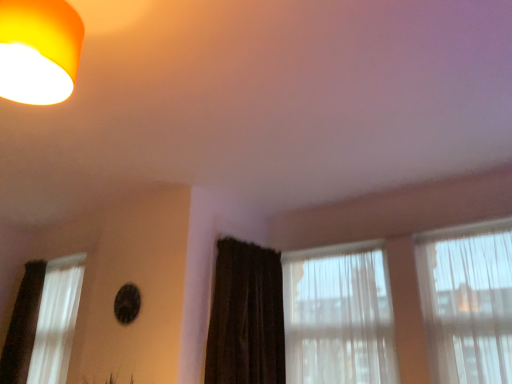
Question: Should I look upward or downward to see translucent fabric curtain at center, positioned as the 2th window in left-to-right order?

Choices:
 (A) down
 (B) up

Answer: (A)

Question: From a real-world perspective, is translucent fabric curtain at center, positioned as the second window in right-to-left order, below translucent fabric curtain at right, placed as the first window when sorted from right to left?

Choices:
 (A) no
 (B) yes

Answer: (B)

Question: From a real-world perspective, is translucent fabric curtain at center, positioned as the second window in right-to-left order, located higher than translucent fabric curtain at right, placed as the first window when sorted from right to left?

Choices:
 (A) yes
 (B) no

Answer: (B)

Question: From the image's perspective, is translucent fabric curtain at center, positioned as the 2th window in left-to-right order, over translucent fabric curtain at right, placed as the first window when sorted from right to left?

Choices:
 (A) no
 (B) yes

Answer: (A)

Question: Considering the relative positions of translucent fabric curtain at center, positioned as the 2th window in left-to-right order, and translucent fabric curtain at right, placed as the third window when sorted from left to right, in the image provided, is translucent fabric curtain at center, positioned as the 2th window in left-to-right order, to the left of translucent fabric curtain at right, placed as the third window when sorted from left to right, from the viewer's perspective?

Choices:
 (A) no
 (B) yes

Answer: (B)

Question: Is there a large distance between translucent fabric curtain at center, positioned as the second window in right-to-left order, and translucent fabric curtain at right, placed as the third window when sorted from left to right?

Choices:
 (A) yes
 (B) no

Answer: (B)

Question: Is translucent fabric curtain at right, placed as the third window when sorted from left to right, surrounded by translucent fabric curtain at center, positioned as the 2th window in left-to-right order?

Choices:
 (A) no
 (B) yes

Answer: (A)

Question: Is there a large distance between dark brown textured curtain at center and matte orange lampshade at upper left?

Choices:
 (A) no
 (B) yes

Answer: (B)

Question: Does dark brown textured curtain at center appear on the right side of matte orange lampshade at upper left?

Choices:
 (A) no
 (B) yes

Answer: (B)

Question: Considering the relative positions of dark brown textured curtain at center and matte orange lampshade at upper left in the image provided, is dark brown textured curtain at center to the left of matte orange lampshade at upper left from the viewer's perspective?

Choices:
 (A) no
 (B) yes

Answer: (A)

Question: Is dark brown textured curtain at center oriented towards matte orange lampshade at upper left?

Choices:
 (A) yes
 (B) no

Answer: (B)

Question: From a real-world perspective, is dark brown textured curtain at center positioned under matte orange lampshade at upper left based on gravity?

Choices:
 (A) no
 (B) yes

Answer: (B)

Question: From a real-world perspective, is dark brown textured curtain at center on matte orange lampshade at upper left?

Choices:
 (A) yes
 (B) no

Answer: (B)

Question: From a real-world perspective, is translucent fabric curtain at right, placed as the third window when sorted from left to right, physically above white sheer curtain at left, the third window in the right-to-left sequence?

Choices:
 (A) yes
 (B) no

Answer: (A)